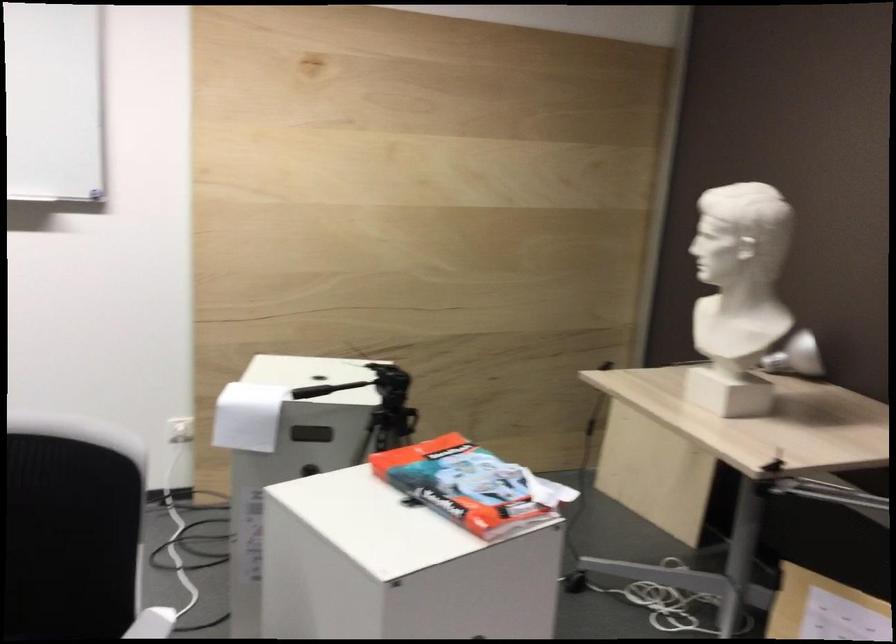
The width and height of the screenshot is (896, 644). Identify the location of tripod adjustment handle. (325, 389).